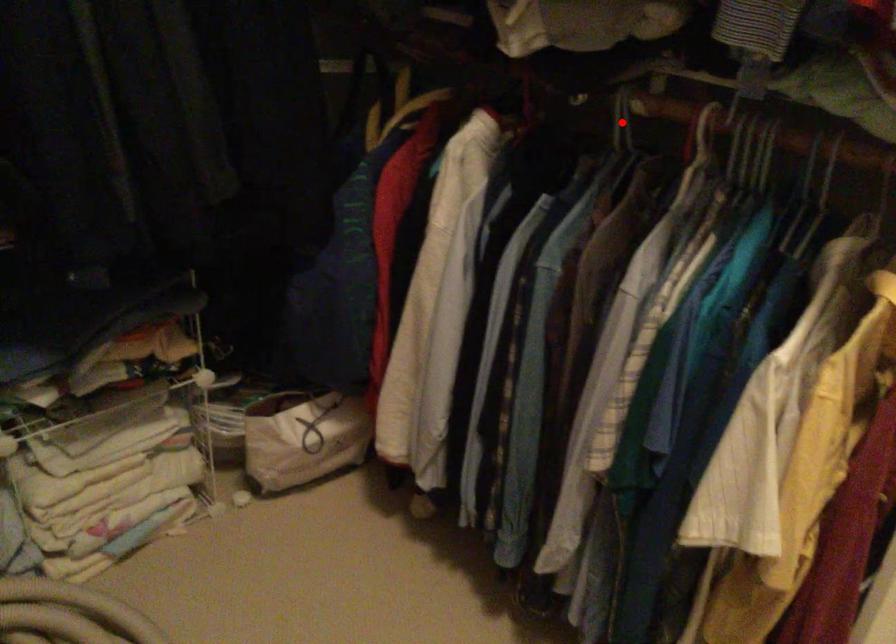
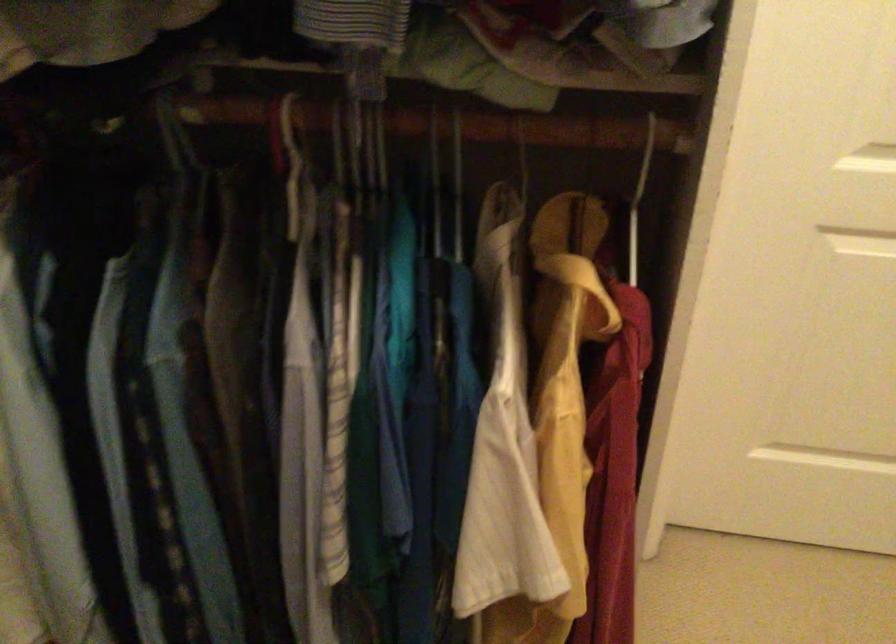
In the second image, find the point that corresponds to the highlighted location in the first image.

(179, 138)